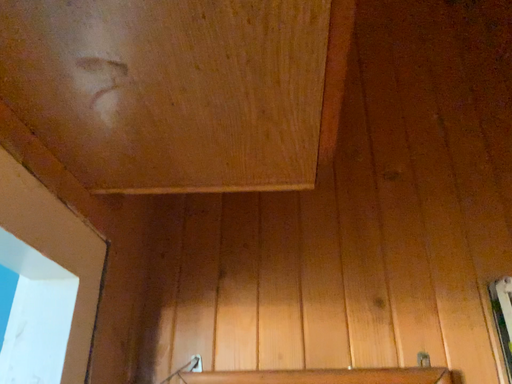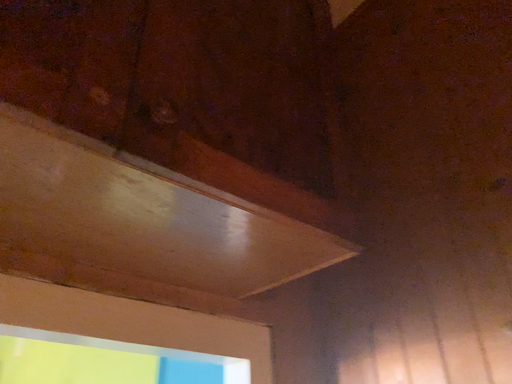
Question: Which way did the camera rotate in the video?

Choices:
 (A) rotated right
 (B) rotated left

Answer: (B)